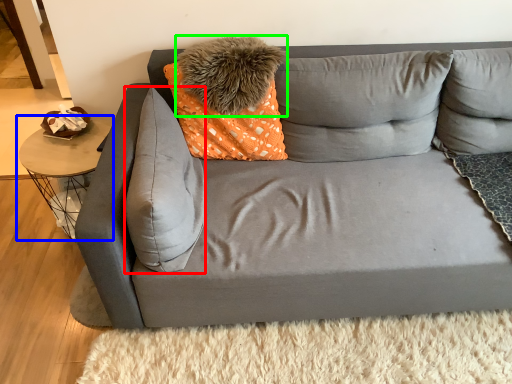
Question: Which object is the farthest from pillow (highlighted by a red box)? Choose among these: table (highlighted by a blue box) or pillow (highlighted by a green box).

Choices:
 (A) table
 (B) pillow

Answer: (A)